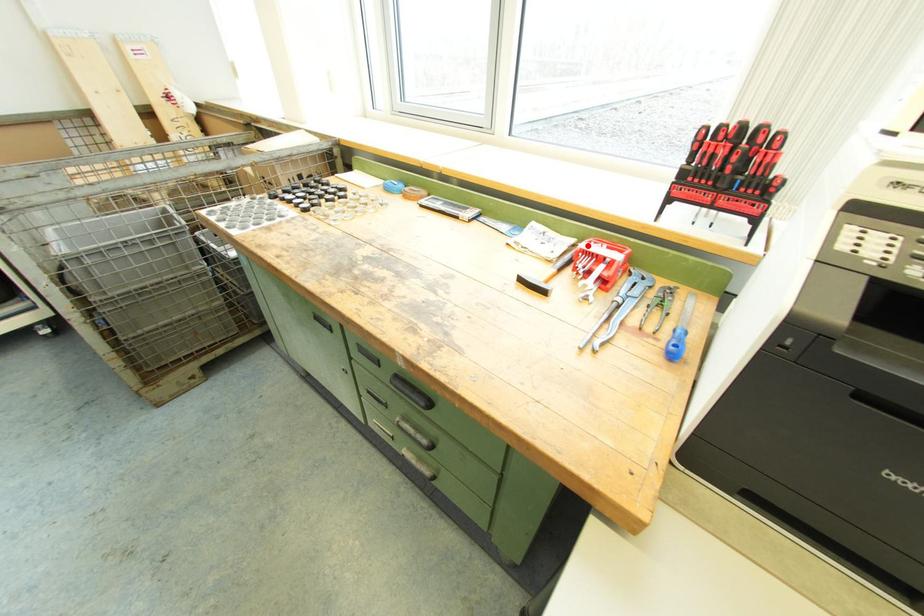
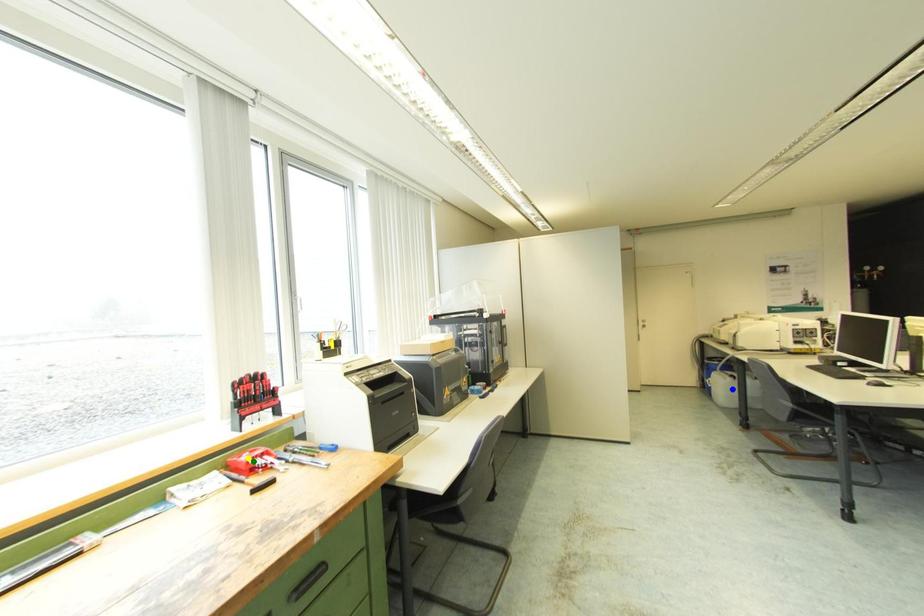
Question: I am providing you with two images of the same scene from different viewpoints. A red point is marked on the first image. You are given multiple points on the second image. In image 2, which mark is for the same physical point as the one in image 1?

Choices:
 (A) green point
 (B) blue point
 (C) yellow point

Answer: (C)